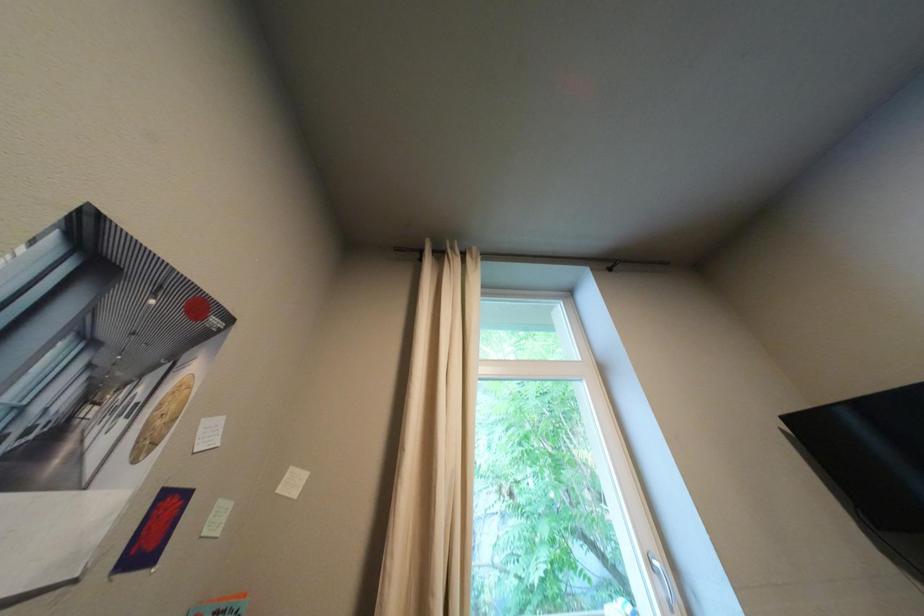
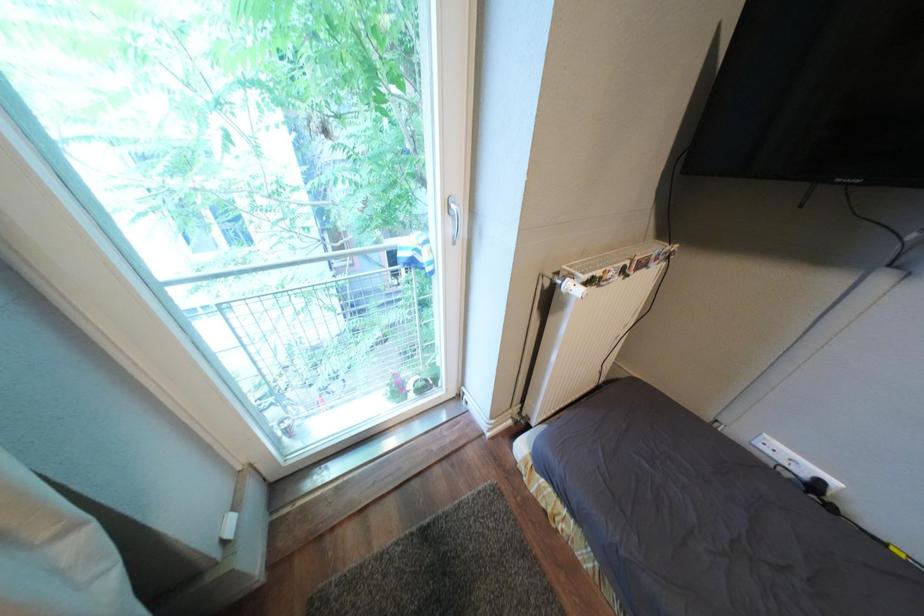
From the picture: The images are taken continuously from a first-person perspective. In which direction is your viewpoint rotating?

The camera's rotation is toward right-down.